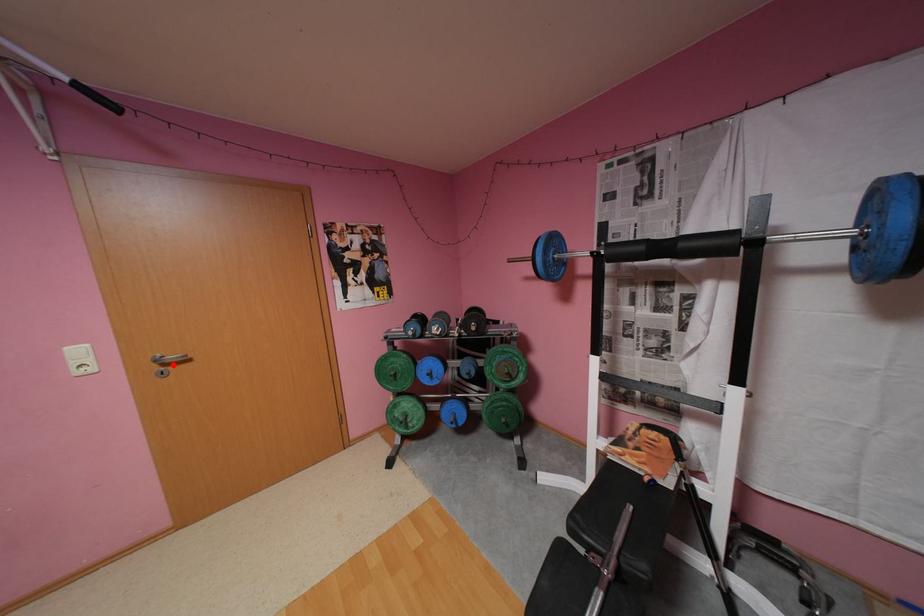
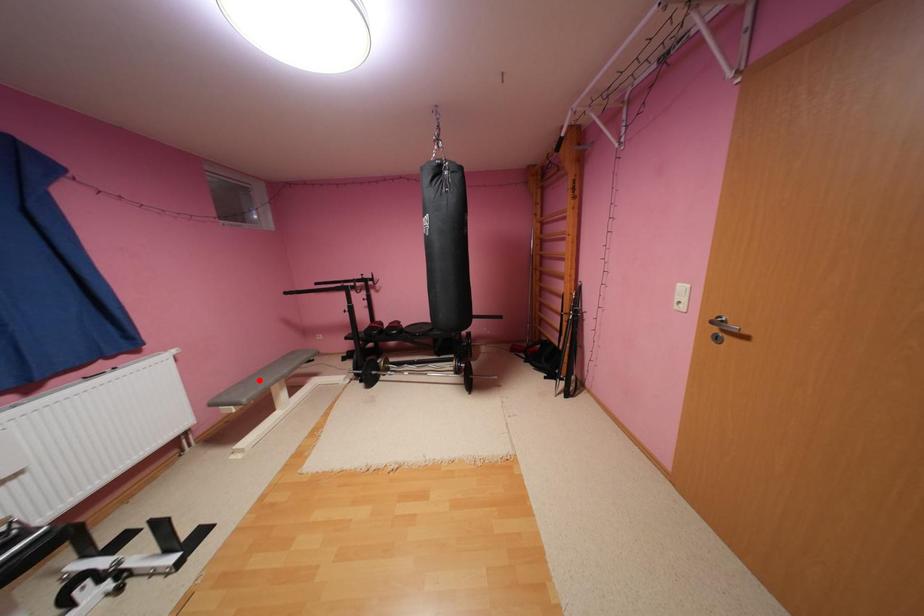
I am providing you with two images of the same scene from different viewpoints. A red point is marked on the first image and another point is marked on the second image. Are the points marked in image1 and image2 representing the same 3D position?

No